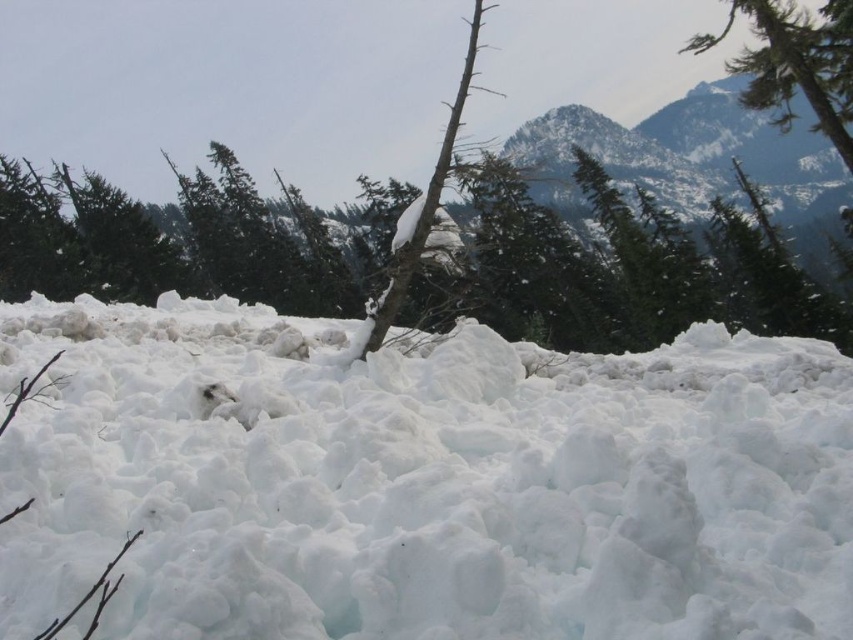
Question: Which point is closer to the camera taking this photo?

Choices:
 (A) (822, 44)
 (B) (447, 148)
 (C) (305, 499)

Answer: (C)

Question: Is the position of snowy rocky mountain at upper center less distant than that of green textured tree at upper right?

Choices:
 (A) yes
 (B) no

Answer: (B)

Question: Does white fluffy snow at center have a greater width compared to snowy bark tree at center?

Choices:
 (A) yes
 (B) no

Answer: (B)

Question: Which of the following is the closest to the observer?

Choices:
 (A) (9, 529)
 (B) (750, 308)
 (C) (843, 182)
 (D) (807, 80)

Answer: (A)

Question: Which is farther from the snowy rocky mountain at upper center?

Choices:
 (A) green textured tree at upper right
 (B) snow-covered branch at center
 (C) snowy bark tree at center
 (D) white fluffy snow at center

Answer: (D)

Question: Observing the image, what is the correct spatial positioning of snowy bark tree at center in reference to snow-covered branch at center?

Choices:
 (A) left
 (B) right

Answer: (B)